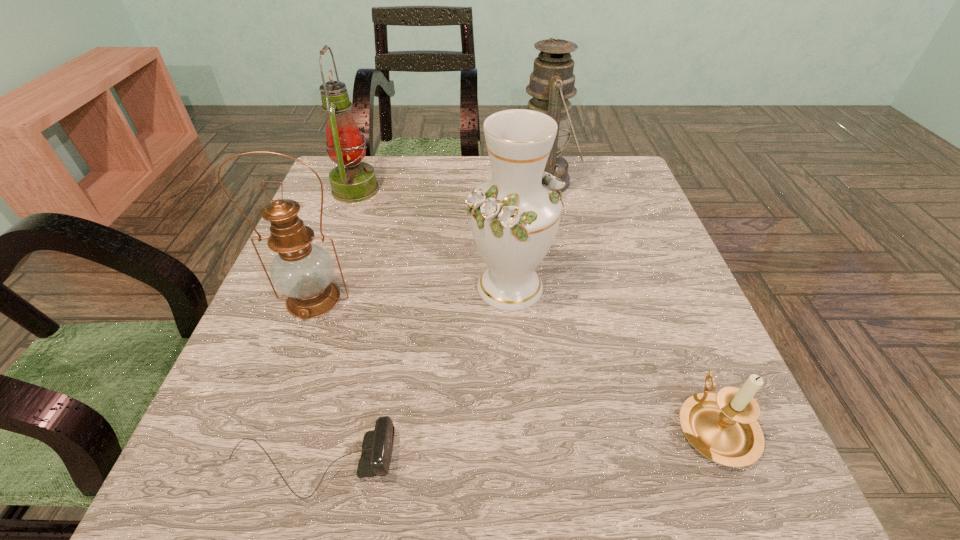
You are a GUI agent. You are given a task and a screenshot of the screen. Output one action in this format:
    pyautogui.click(x=<x>, y=<y>)
    Task: Click on the rightmost oil lamp
    Image resolution: width=960 pixels, height=540 pixels.
    Given the screenshot: What is the action you would take?
    pyautogui.click(x=552, y=81)

Image resolution: width=960 pixels, height=540 pixels. I want to click on vase, so click(514, 217).

What are the coordinates of `the nearest oil lamp` in the screenshot? It's located at (303, 271).

Find the location of a particular element. The image size is (960, 540). the rightmost object is located at coordinates (723, 427).

Locate an element on the screen. candle holder is located at coordinates (723, 427).

Locate an element on the screen. The image size is (960, 540). webcam is located at coordinates (377, 446).

You are a GUI agent. You are given a task and a screenshot of the screen. Output one action in this format:
    pyautogui.click(x=<x>, y=<y>)
    Task: Click on the blank space located 0.100m on the right of the rightmost oil lamp
    This screenshot has height=540, width=960.
    Given the screenshot: What is the action you would take?
    [x=613, y=181]

Image resolution: width=960 pixels, height=540 pixels. Find the location of `vacant space located 0.370m on the left of the vase`. vacant space located 0.370m on the left of the vase is located at coordinates (284, 287).

At what (x,y) coordinates should I click in order to perform the action: click on free space located 0.140m on the back of the nearest oil lamp. Please return your answer as a coordinate pair (x, y). Looking at the image, I should click on (337, 236).

The width and height of the screenshot is (960, 540). Identify the location of free point located 0.240m with a handle on the side of the rightmost object. (657, 283).